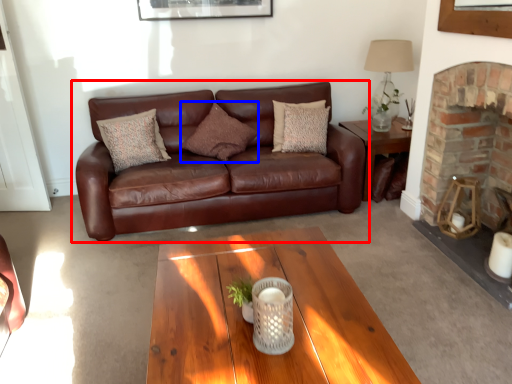
Question: Among these objects, which one is farthest to the camera, studio couch (highlighted by a red box) or pillow (highlighted by a blue box)?

Choices:
 (A) studio couch
 (B) pillow

Answer: (B)